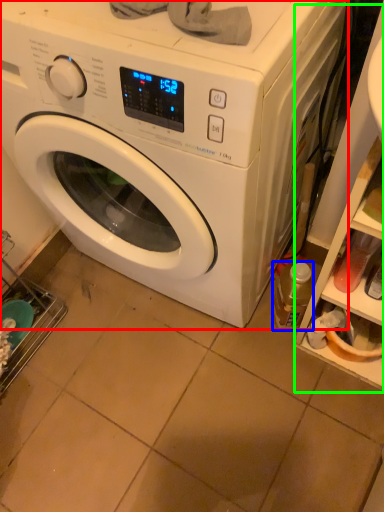
Question: Which is nearer to the washing machine (highlighted by a red box)? bottle (highlighted by a blue box) or shelf (highlighted by a green box).

Choices:
 (A) bottle
 (B) shelf

Answer: (B)